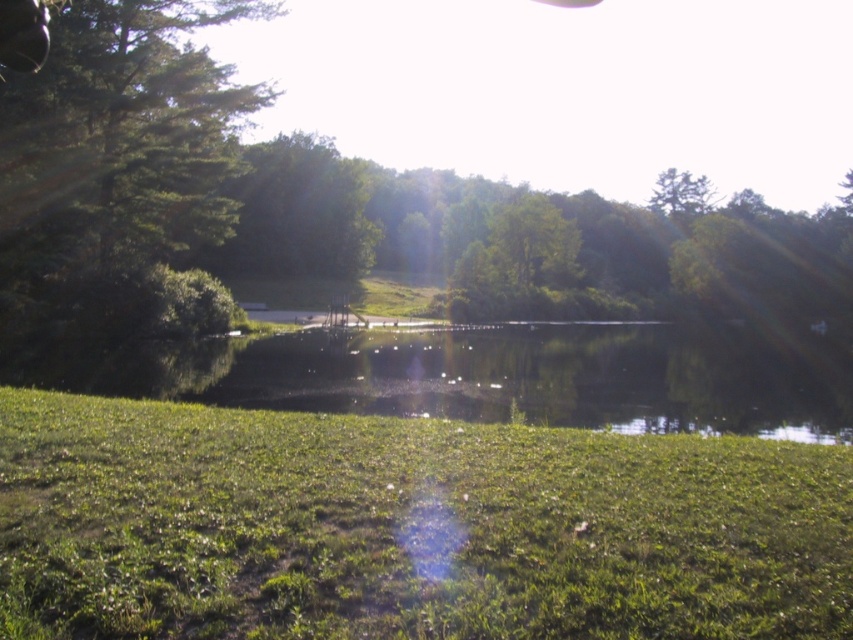
You are standing in the park and see the green grassy at lower center and the green leafy tree at upper left. Which object is positioned to the right of the other?

The green grassy at lower center is to the right of the green leafy tree at upper left.

Consider the image. You are standing in the park and want to walk from the green grassy at lower center to the green leafy tree at upper left. Which direction should you move to get closer to the tree?

To get closer to the green leafy tree at upper left, you should move towards the upper left direction since the tree is located in that area of the scene.

You are a gardener planning to mow the green grassy at lower center and trim the green leafy tree at upper left. Which area requires more horizontal space to work around?

The green leafy tree at upper left requires more horizontal space to work around since it has a greater width than the green grassy at lower center.